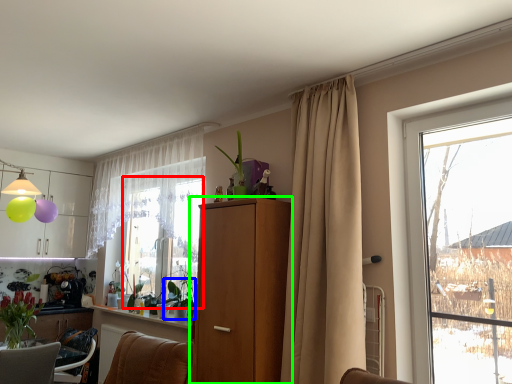
Question: Which object is positioned closest to window screen (highlighted by a red box)? Select from plant (highlighted by a blue box) and cabinetry (highlighted by a green box).

Choices:
 (A) plant
 (B) cabinetry

Answer: (A)